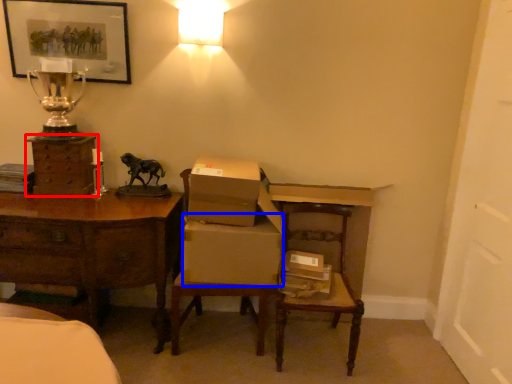
Question: Among these objects, which one is farthest to the camera, chest of drawers (highlighted by a red box) or cardboard box (highlighted by a blue box)?

Choices:
 (A) chest of drawers
 (B) cardboard box

Answer: (A)